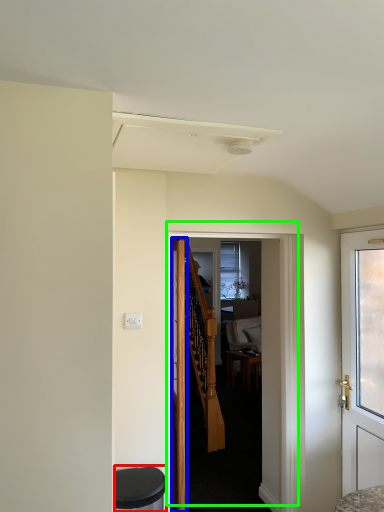
Question: Considering the real-world distances, which object is closest to music stool (highlighted by a red box)? door (highlighted by a blue box) or door (highlighted by a green box).

Choices:
 (A) door
 (B) door

Answer: (A)